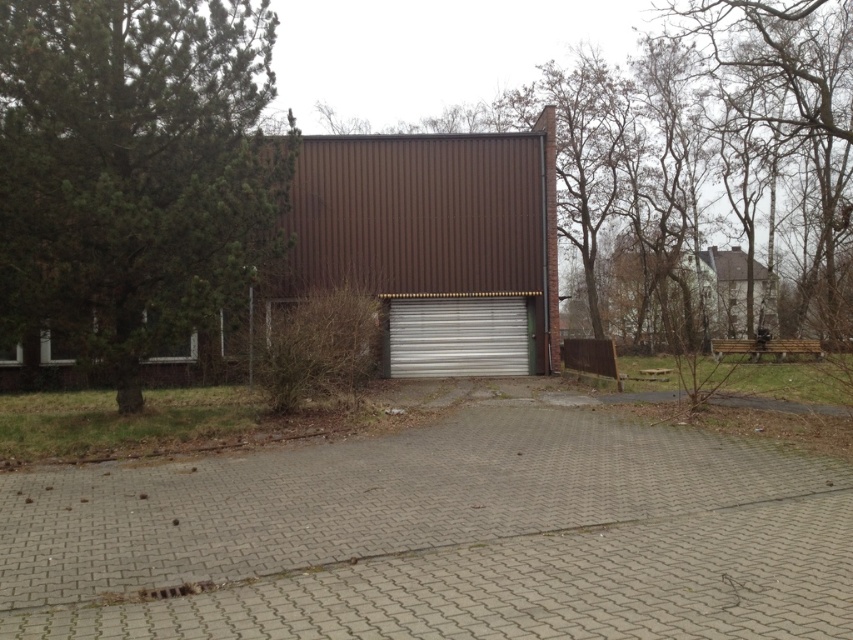
You are a delivery driver who needs to park your truck in front of the building. The truck is 2 meters wide. The paved area in front of the building is 3 meters wide. The brown corrugated metal garage at center and the silver metallic garage door at center are positioned such that there is a gap between them. Can your truck fit between them on the paved area?

The brown corrugated metal garage at center is to the left of the silver metallic garage door at center, creating a gap between them. Since the paved area is 3 meters wide and the truck is only 2 meters wide, the truck can fit between them as long as the gap is at least 2 meters wide. However, the exact width of the gap isn not specified in the description, so it depends on the actual space available between the two structures.

You are a delivery person trying to unload a package that requires knowing the height clearance of the garage door. The package is 2 meters tall. Can you safely pass through the silver metallic garage door at center if the brown corrugated metal garage at center is 3 meters tall?

The brown corrugated metal garage at center is taller than the silver metallic garage door at center. Since the garage itself is 3 meters tall, the garage door must be shorter than that. Therefore, the 2 meter tall package can safely pass through the silver metallic garage door at center as it is shorter than 3 meters.